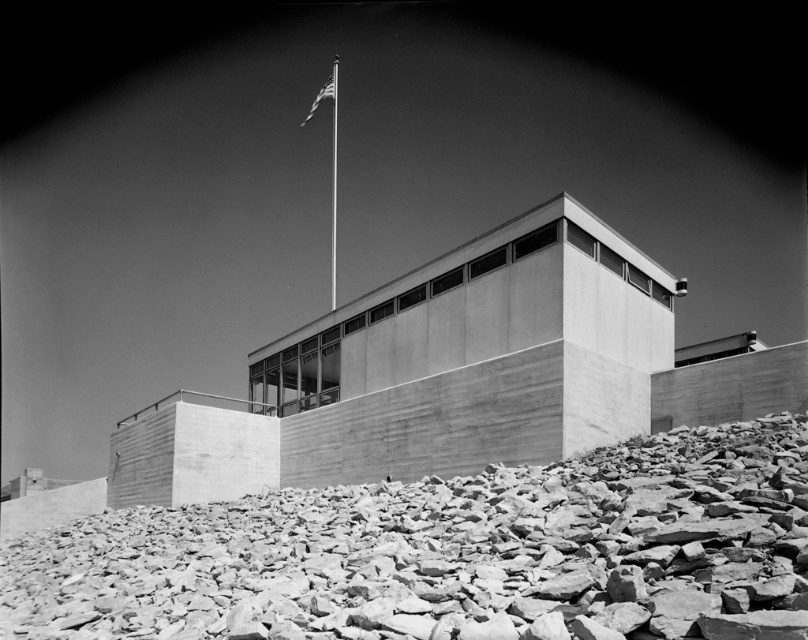
Is smooth gray rocks at bottom taller than american flag at upper center?

No, smooth gray rocks at bottom is not taller than american flag at upper center.

Is smooth gray rocks at bottom further to camera compared to american flag at upper center?

No, it is in front of american flag at upper center.

The width and height of the screenshot is (808, 640). In order to click on smooth gray rocks at bottom in this screenshot , I will do `click(451, 554)`.

Which is more to the left, smooth gray rocks at bottom or metallic flag pole at upper center?

metallic flag pole at upper center

Is smooth gray rocks at bottom shorter than metallic flag pole at upper center?

Indeed, smooth gray rocks at bottom has a lesser height compared to metallic flag pole at upper center.

Is point (234, 541) farther from viewer compared to point (335, 134)?

No.

Where is `smooth gray rocks at bottom`? smooth gray rocks at bottom is located at coordinates (451, 554).

Which of these two, metallic flag pole at upper center or american flag at upper center, stands taller?

With more height is metallic flag pole at upper center.

Is point (335, 173) positioned behind point (309, 113)?

That is True.

This screenshot has height=640, width=808. What are the coordinates of `metallic flag pole at upper center` in the screenshot? It's located at (333, 176).